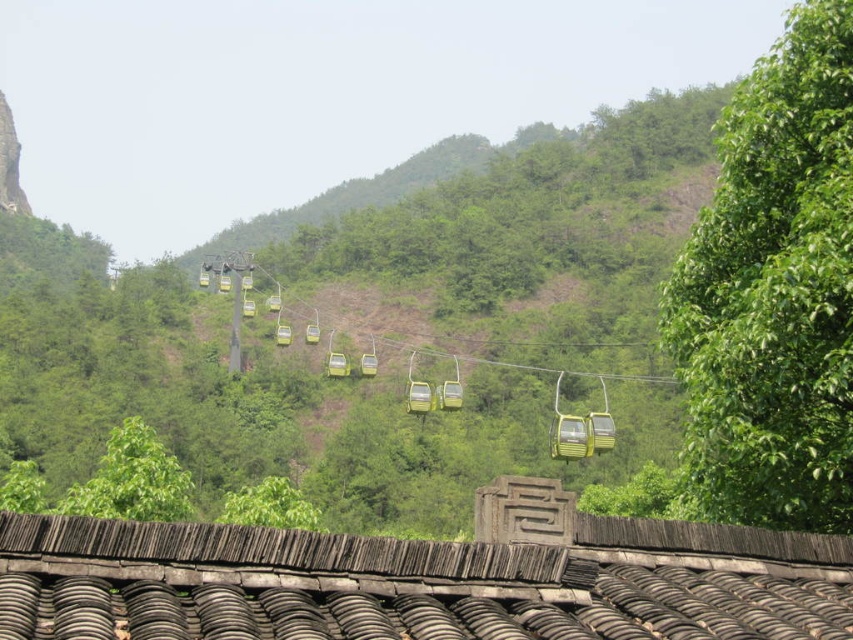
In the scene shown: Does green leafy tree at right have a greater width compared to yellow matte/glossy cable car at center?

In fact, green leafy tree at right might be narrower than yellow matte/glossy cable car at center.

Describe the element at coordinates (775, 291) in the screenshot. The image size is (853, 640). I see `green leafy tree at right` at that location.

Is point (717, 508) closer to camera compared to point (561, 452)?

Yes, point (717, 508) is closer to viewer.

This screenshot has width=853, height=640. Find the location of `green leafy tree at right`. green leafy tree at right is located at coordinates (775, 291).

Can you confirm if green leafy tree at right is shorter than green leafy tree at lower left?

Yes, green leafy tree at right is shorter than green leafy tree at lower left.

Between point (740, 486) and point (138, 513), which one is positioned behind?

The point (138, 513) is behind.

Where is `green leafy tree at right`? Image resolution: width=853 pixels, height=640 pixels. green leafy tree at right is located at coordinates (775, 291).

Who is shorter, green leafy tree at lower left or green leafy tree at center?

green leafy tree at center is shorter.

Does green leafy tree at lower left appear over green leafy tree at center?

Indeed, green leafy tree at lower left is positioned over green leafy tree at center.

Who is more distant from viewer, (138, 448) or (277, 477)?

The point (277, 477) is more distant.

You are a GUI agent. You are given a task and a screenshot of the screen. Output one action in this format:
    pyautogui.click(x=<x>, y=<y>)
    Task: Click on the green leafy tree at lower left
    The height and width of the screenshot is (640, 853).
    Given the screenshot: What is the action you would take?
    pyautogui.click(x=132, y=480)